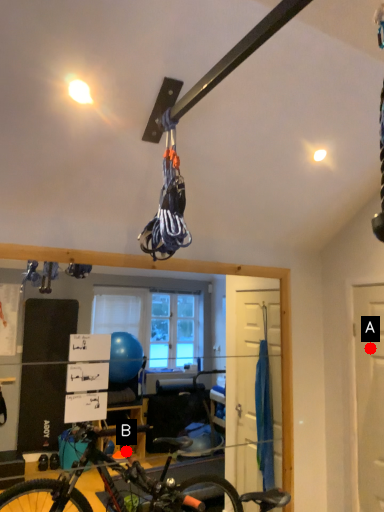
Question: Two points are circled on the image, labeled by A and B beside each circle. Which point is closer to the camera taking this photo?

Choices:
 (A) A is closer
 (B) B is closer

Answer: (B)